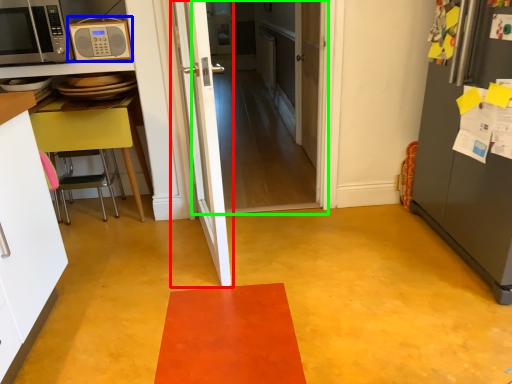
Question: Which is farther away from door (highlighted by a red box)? microwave oven (highlighted by a blue box) or door (highlighted by a green box)?

Choices:
 (A) microwave oven
 (B) door

Answer: (B)